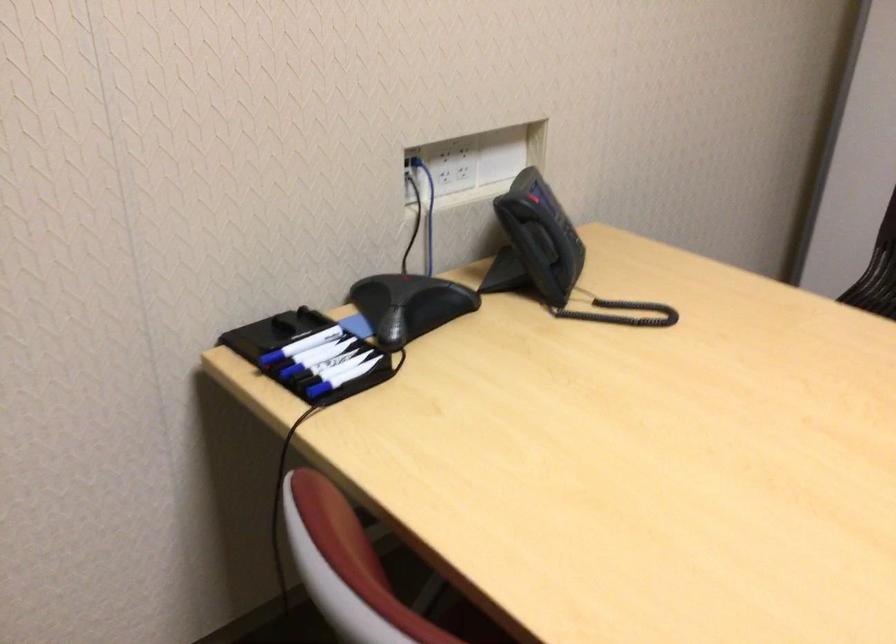
The height and width of the screenshot is (644, 896). Find the location of `blue network plug`. blue network plug is located at coordinates (320, 393).